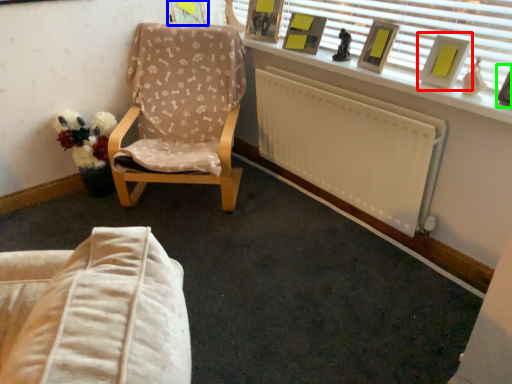
Question: Which is nearer to the picture frame (highlighted by a red box)? picture frame (highlighted by a blue box) or picture frame (highlighted by a green box).

Choices:
 (A) picture frame
 (B) picture frame

Answer: (B)